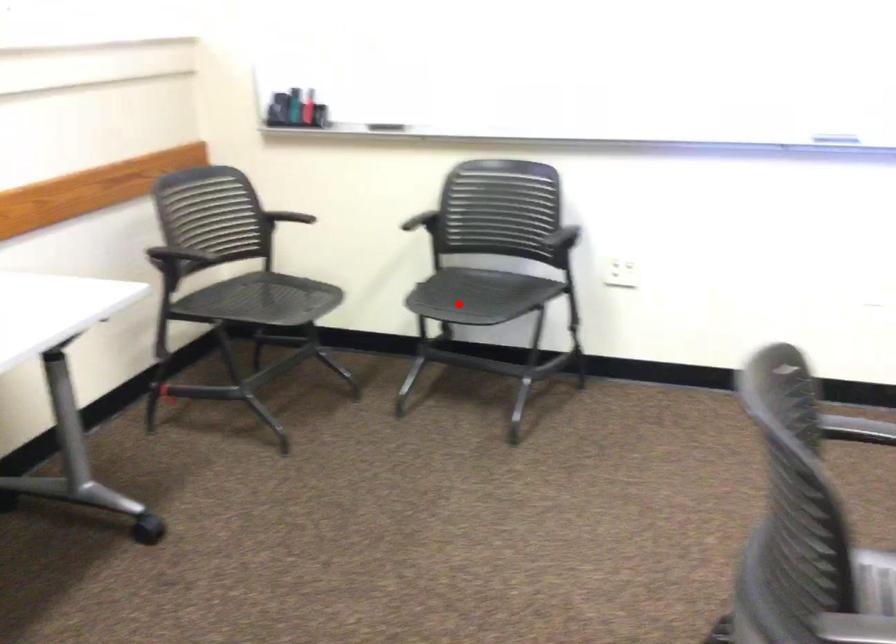
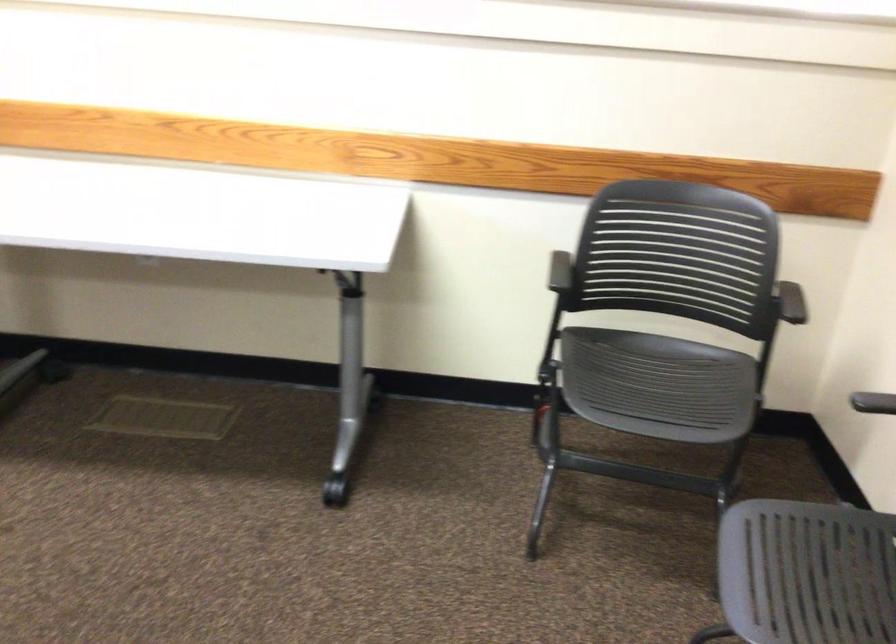
The point at the highlighted location is marked in the first image. Where is the corresponding point in the second image?

(806, 573)